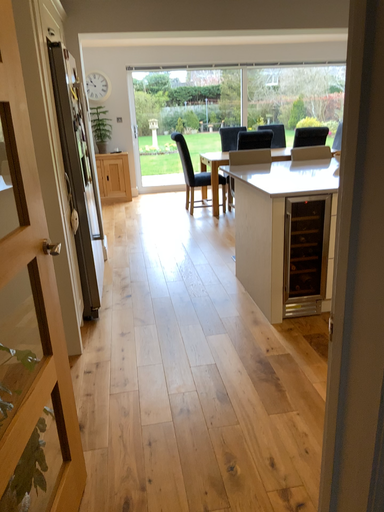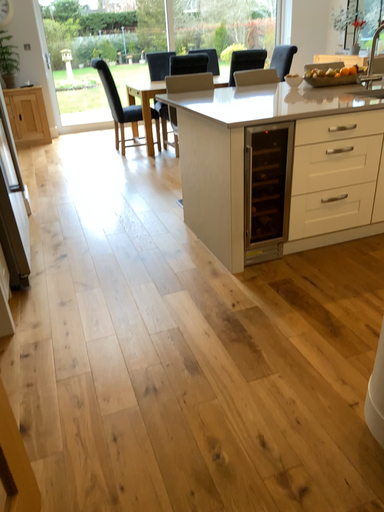
Question: Which way did the camera rotate in the video?

Choices:
 (A) rotated downward
 (B) rotated upward

Answer: (A)